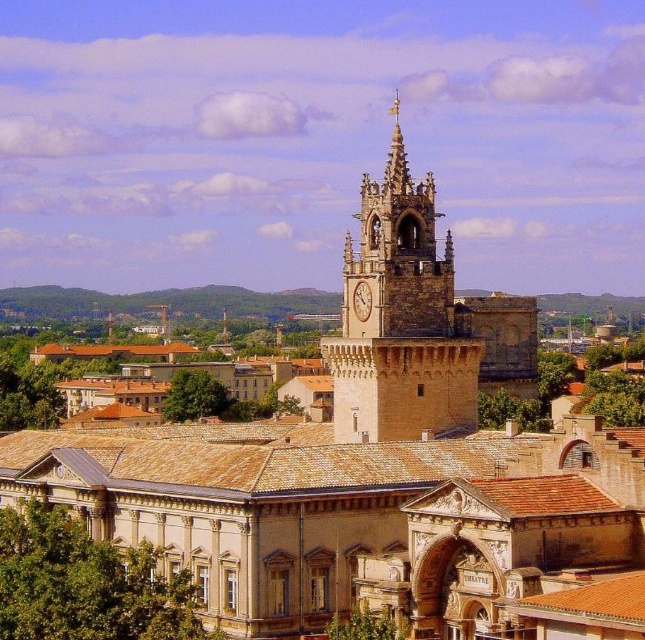
You are standing in the historic city square and want to take a photo of the grand clock tower. You notice two specific points in the scene marked as point 1 at coordinates (x=392, y=307) and point 2 at coordinates (x=361, y=289). Which point is closer to you when you are facing the tower?

Point 1 at coordinates (x=392, y=307) is closer to the viewer than point 2 at coordinates (x=361, y=289).

You are an architect designing a new city square and want to ensure proper spacing between the stone clock tower at center and the gold textured clock at center. Based on the image, which object has a greater width and should be allocated more space in the design?

The stone clock tower at center has a larger width than the gold textured clock at center, so it should be allocated more space in the design.

From the picture: You are an architect analyzing the cityscape. From your vantage point, which object would block your view of the gold textured clock at center if you were to stand directly in front of the stone clock tower at center?

The stone clock tower at center is in front of the gold textured clock at center, so standing directly in front of the stone clock tower at center would block your view of the gold textured clock at center.